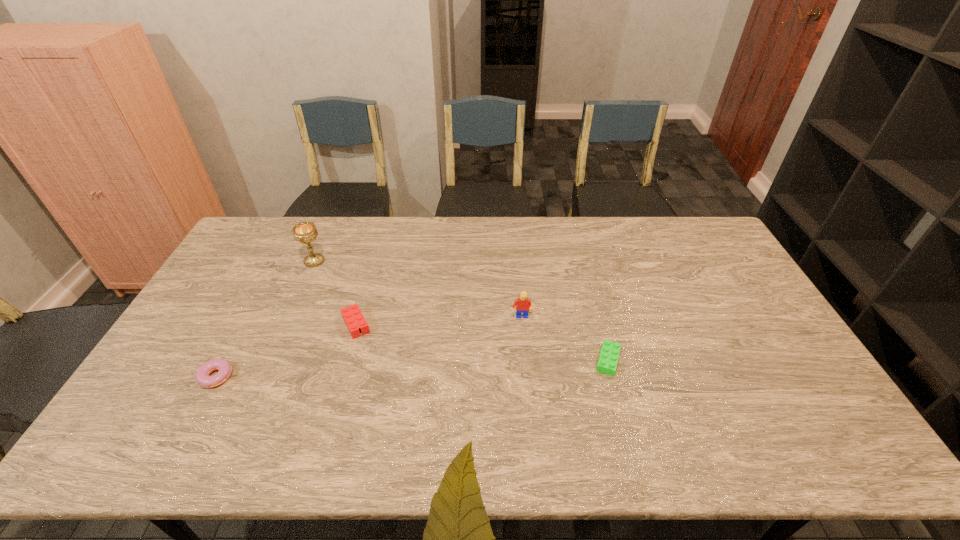
What are the coordinates of `object that can be found as the third closest to the leftmost object` in the screenshot? It's located at (523, 304).

Select which object appears as the third closest to the doughnut. Please provide its 2D coordinates. Your answer should be formatted as a tuple, i.e. [(x, y)], where the tuple contains the x and y coordinates of a point satisfying the conditions above.

[(523, 304)]

Identify the location of the second closest Lego relative to the third object from right to left. (607, 363).

Locate an element on the screen. Lego that is the nearest to the fourth object from right to left is located at coordinates (352, 315).

Locate an element on the screen. vacant point that satisfies the following two spatial constraints: 1. on the front-facing side of the rightmost object; 2. on the right side of the second Lego from left to right is located at coordinates (524, 360).

Locate an element on the screen. The image size is (960, 540). vacant space that satisfies the following two spatial constraints: 1. on the front side of the leftmost Lego; 2. on the left side of the farthest object is located at coordinates (287, 325).

Find the location of a particular element. The image size is (960, 540). free space that satisfies the following two spatial constraints: 1. on the front side of the leftmost Lego; 2. on the right side of the chalice is located at coordinates (287, 325).

This screenshot has height=540, width=960. What are the coordinates of `vacant space that satisfies the following two spatial constraints: 1. on the front-facing side of the nearest Lego; 2. on the right side of the fourth shortest object` in the screenshot? It's located at (524, 360).